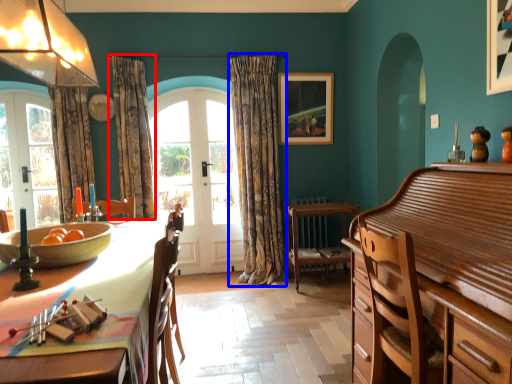
Question: Which of the following is the closest to the observer, curtain (highlighted by a red box) or curtain (highlighted by a blue box)?

Choices:
 (A) curtain
 (B) curtain

Answer: (A)